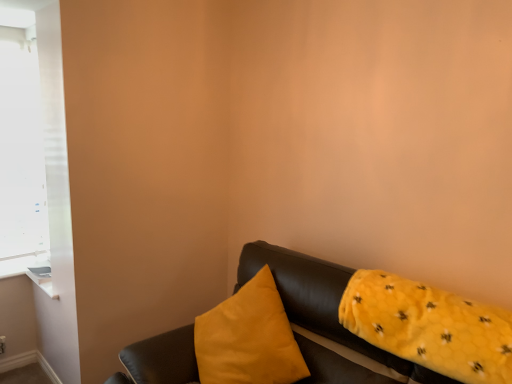
Question: Considering the positions of white matte window at upper left and leather couch at lower right in the image, is white matte window at upper left bigger or smaller than leather couch at lower right?

Choices:
 (A) small
 (B) big

Answer: (A)

Question: In the image, is white matte window at upper left on the left side or the right side of leather couch at lower right?

Choices:
 (A) right
 (B) left

Answer: (B)

Question: Considering the real-world distances, which object is closest to the leather couch at lower right?

Choices:
 (A) white matte window at upper left
 (B) matte yellow pillow at center, the first pillow positioned from the left
 (C) yellow fuzzy pillow at right, arranged as the second pillow when viewed from the left

Answer: (C)

Question: Which object is the closest to the yellow fuzzy pillow at right, the 1th pillow in the right-to-left sequence?

Choices:
 (A) white matte window at upper left
 (B) matte yellow pillow at center, the first pillow positioned from the left
 (C) leather couch at lower right

Answer: (C)